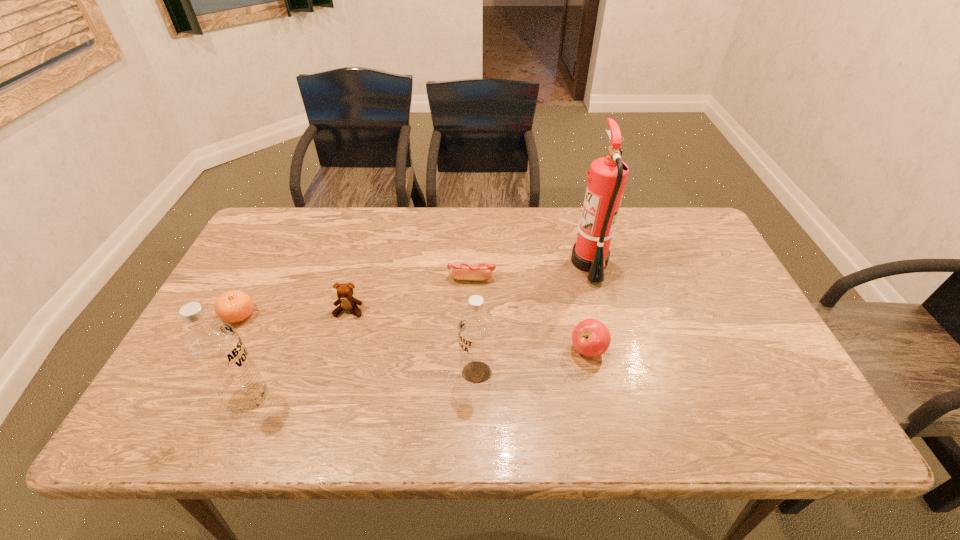
The height and width of the screenshot is (540, 960). I want to click on free space located on the front label of the taller vodka, so click(x=372, y=399).

Identify the location of vacant area situated on the front label of the third tallest object. The height and width of the screenshot is (540, 960). (353, 373).

Identify the location of free space located on the front label of the third tallest object. This screenshot has width=960, height=540. (367, 373).

Find the location of a particular element. The width and height of the screenshot is (960, 540). vacant area situated on the front label of the third tallest object is located at coordinates point(328,373).

Locate an element on the screen. vacant space located 0.200m at the nozzle of the tallest object is located at coordinates (504, 262).

Where is `vacant space situated at the nozzle of the tallest object`? This screenshot has height=540, width=960. vacant space situated at the nozzle of the tallest object is located at coordinates (465, 262).

The image size is (960, 540). I want to click on vacant region located 0.060m at the nozzle of the tallest object, so click(551, 262).

Where is `free location located 0.220m on the right of the shortest object`? The width and height of the screenshot is (960, 540). free location located 0.220m on the right of the shortest object is located at coordinates (572, 278).

Where is `vacant space located 0.150m on the front-facing side of the fifth object from right to left`? The height and width of the screenshot is (540, 960). vacant space located 0.150m on the front-facing side of the fifth object from right to left is located at coordinates (333, 366).

Where is `blank space located on the front of the leftmost object`? blank space located on the front of the leftmost object is located at coordinates (225, 343).